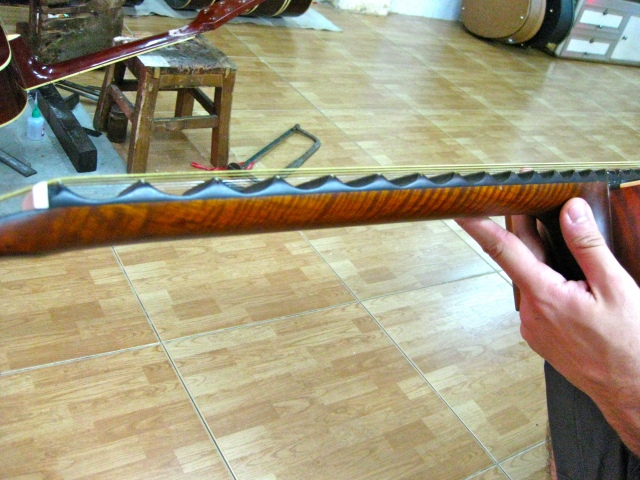
The width and height of the screenshot is (640, 480). Find the location of `rug`. rug is located at coordinates (109, 166).